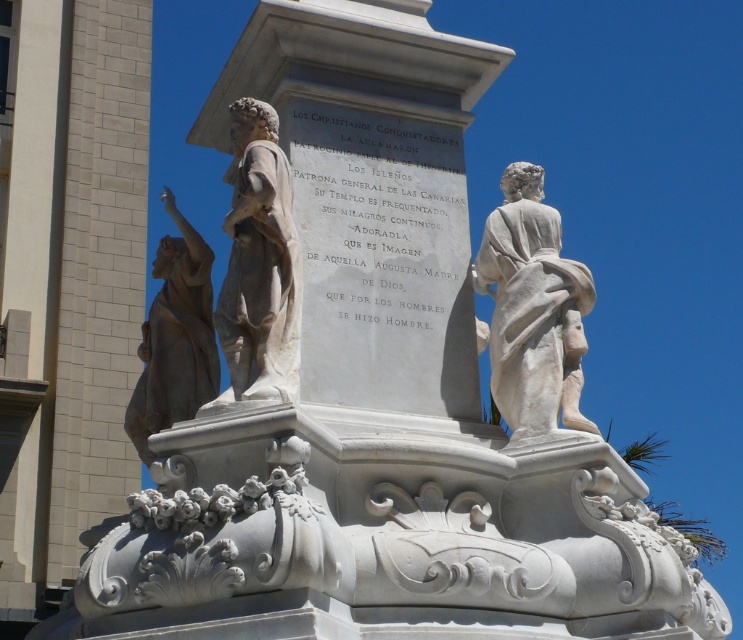
Between point (541, 288) and point (262, 353), which one is positioned behind?

Point (541, 288)

Image resolution: width=743 pixels, height=640 pixels. What do you see at coordinates (533, 308) in the screenshot?
I see `white marble statue at upper right` at bounding box center [533, 308].

The height and width of the screenshot is (640, 743). Find the location of `white marble statue at upper right`. white marble statue at upper right is located at coordinates (533, 308).

Who is lower down, white marble statue at upper right or bronze statue at left?

white marble statue at upper right is below.

Is white marble statue at upper right wider than bronze statue at left?

In fact, white marble statue at upper right might be narrower than bronze statue at left.

At what (x,y) coordinates should I click in order to perform the action: click on white marble statue at upper right. Please return your answer as a coordinate pair (x, y). The width and height of the screenshot is (743, 640). Looking at the image, I should click on (533, 308).

What do you see at coordinates (259, 262) in the screenshot? I see `white marble statue at upper left` at bounding box center [259, 262].

Which is more to the left, white marble statue at upper left or bronze statue at left?

From the viewer's perspective, bronze statue at left appears more on the left side.

This screenshot has height=640, width=743. Find the location of `white marble statue at upper left`. white marble statue at upper left is located at coordinates (259, 262).